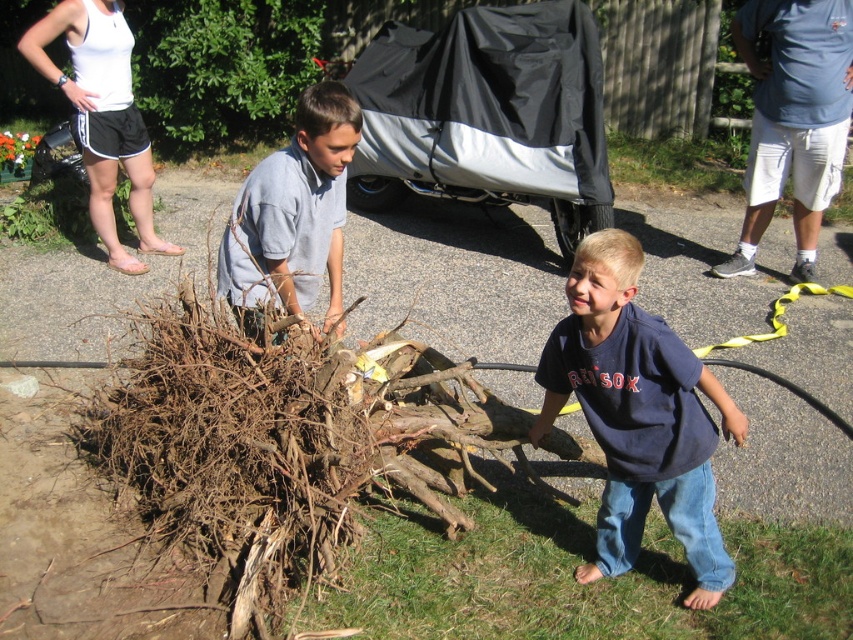
You are a photographer trying to capture a clear photo of both the blue cotton shirt at center and the gray cotton shirt at center. Since you want both subjects to be in focus, which one should you focus on first?

You should focus on the blue cotton shirt at center first because it is in front of the gray cotton shirt at center, so focusing on the closer subject will ensure both are in focus.

What is the exact coordinate position of the blue cotton shirt at center in the image?

The blue cotton shirt at center is located at point (637, 413).

You are standing at the point labeled as point (x=263, y=275) and want to walk towards the paved area where the adults are standing. Which direction should you move relative to the other point labeled point (x=624, y=515)?

Since point (x=624, y=515) is closer to the viewer than point (x=263, y=275), you should move in the direction away from point (x=624, y=515) towards the paved area where the adults are standing.